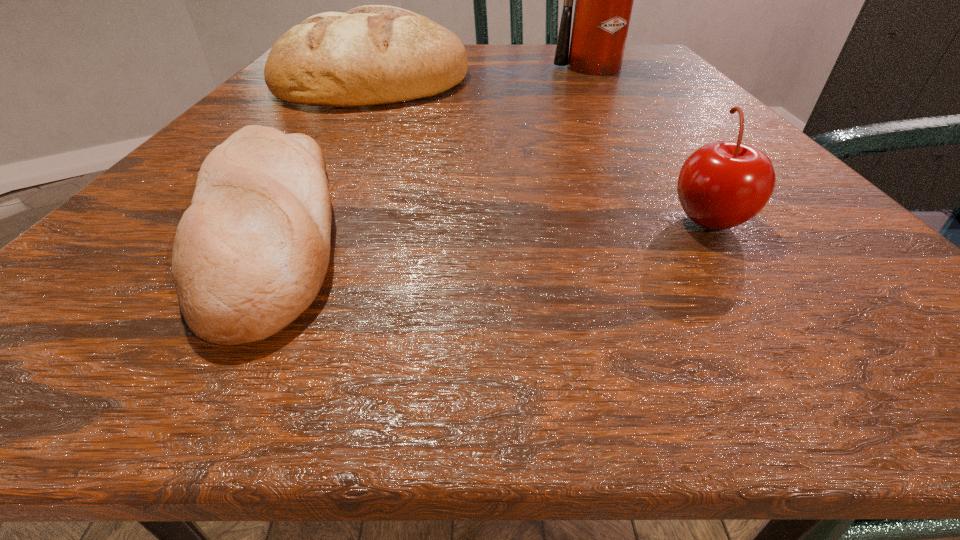
Where is `the closest object to the nearer bread`? Image resolution: width=960 pixels, height=540 pixels. the closest object to the nearer bread is located at coordinates (370, 55).

Locate which object ranks second in proximity to the farther bread. Please provide its 2D coordinates. Your answer should be formatted as a tuple, i.e. [(x, y)], where the tuple contains the x and y coordinates of a point satisfying the conditions above.

[(604, 0)]

Locate an element on the screen. Image resolution: width=960 pixels, height=540 pixels. vacant position in the image that satisfies the following two spatial constraints: 1. on the front side of the cherry; 2. on the left side of the taller bread is located at coordinates (x=293, y=219).